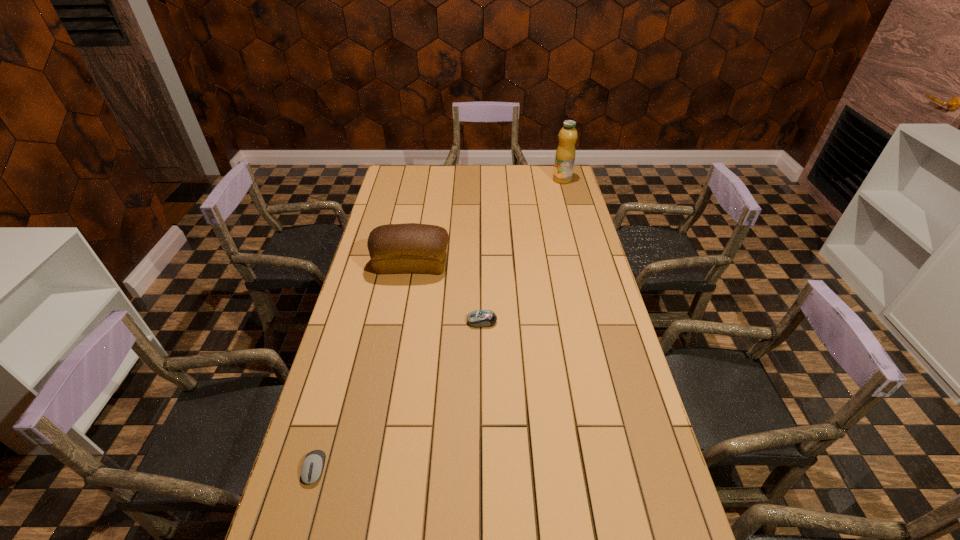
Image resolution: width=960 pixels, height=540 pixels. Find the location of `object that stands as the closest to the left computer equipment`. object that stands as the closest to the left computer equipment is located at coordinates (478, 318).

Identify which computer equipment is the closest to the third shortest object. Please provide its 2D coordinates. Your answer should be formatted as a tuple, i.e. [(x, y)], where the tuple contains the x and y coordinates of a point satisfying the conditions above.

[(478, 318)]

The width and height of the screenshot is (960, 540). Find the location of `computer equipment that is the second closest to the rightmost object`. computer equipment that is the second closest to the rightmost object is located at coordinates (312, 467).

This screenshot has height=540, width=960. Find the location of `free spot that satisfies the following two spatial constraints: 1. on the front label of the fruit juice; 2. on the wheel side of the third farthest object`. free spot that satisfies the following two spatial constraints: 1. on the front label of the fruit juice; 2. on the wheel side of the third farthest object is located at coordinates (x=601, y=321).

This screenshot has width=960, height=540. Identify the location of free location that satisfies the following two spatial constraints: 1. on the front label of the tallest object; 2. on the wheel side of the second object from right to left. pyautogui.click(x=601, y=321).

The width and height of the screenshot is (960, 540). Find the location of `blank space that satisfies the following two spatial constraints: 1. on the wheel side of the third object from left to right; 2. on the wheel side of the left computer equipment`. blank space that satisfies the following two spatial constraints: 1. on the wheel side of the third object from left to right; 2. on the wheel side of the left computer equipment is located at coordinates (483, 469).